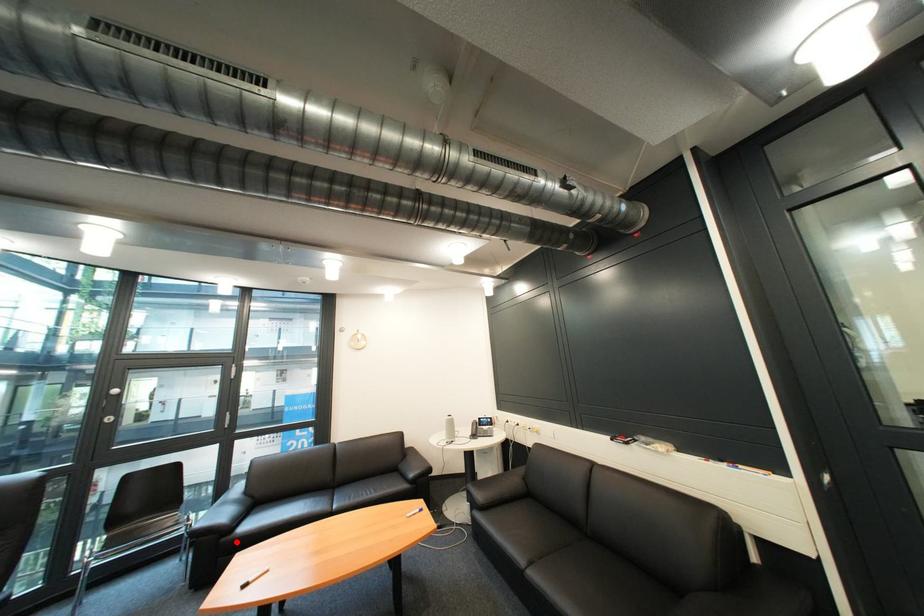
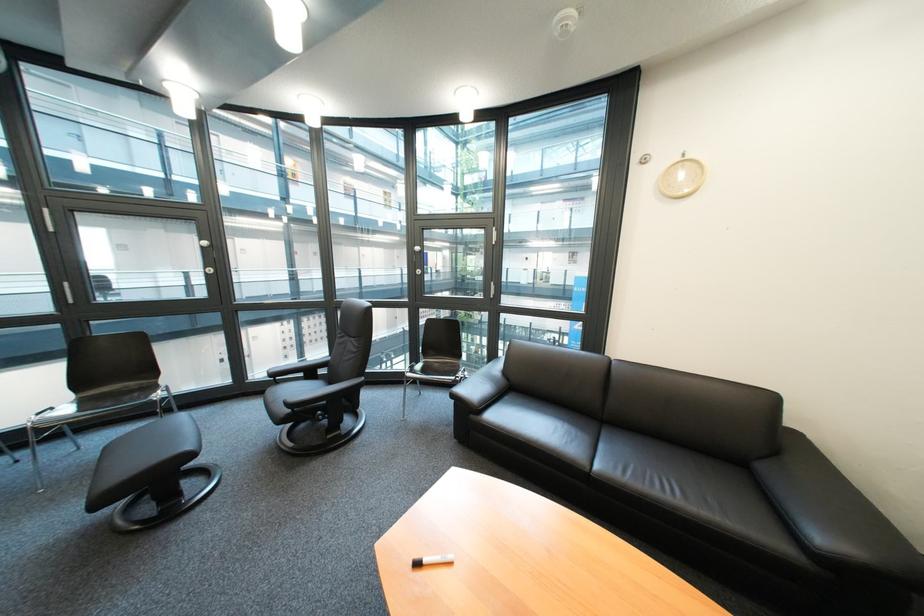
Where in the second image is the point corresponding to the highlighted location from the first image?

(485, 418)